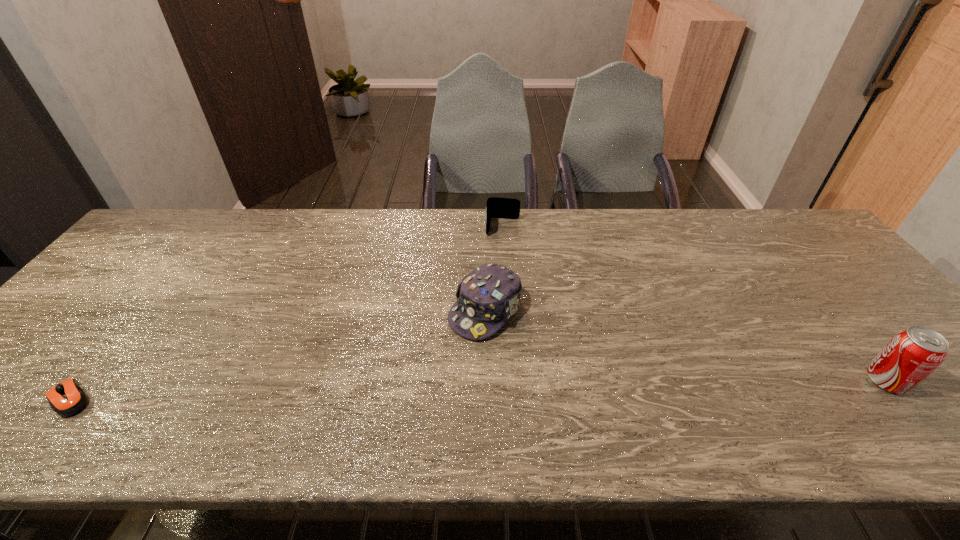
This screenshot has height=540, width=960. What are the coordinates of `object that is at the right edge` in the screenshot? It's located at (913, 354).

Locate an element on the screen. This screenshot has height=540, width=960. object present at the near left corner is located at coordinates (67, 398).

I want to click on object that is at the near right corner, so click(x=913, y=354).

Identify the location of vacant space at the far edge. The image size is (960, 540). (258, 244).

I want to click on vacant space at the near edge, so click(307, 377).

Locate an element on the screen. The width and height of the screenshot is (960, 540). blank space at the left edge of the desktop is located at coordinates (110, 276).

Find the location of a particular element. This screenshot has height=540, width=960. blank area at the right edge is located at coordinates (790, 261).

Locate an element on the screen. The width and height of the screenshot is (960, 540). free location at the far left corner of the desktop is located at coordinates (192, 220).

Image resolution: width=960 pixels, height=540 pixels. What are the coordinates of `vacant area at the far right corner` in the screenshot? It's located at (779, 219).

Find the location of a particular element. Image resolution: width=960 pixels, height=540 pixels. free space between the third tallest object and the leftmost object is located at coordinates (286, 313).